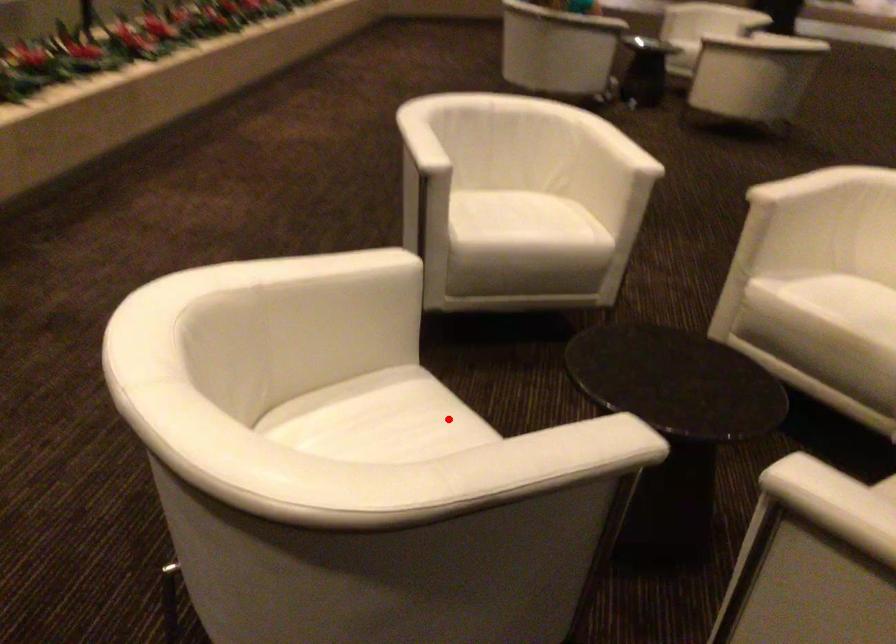
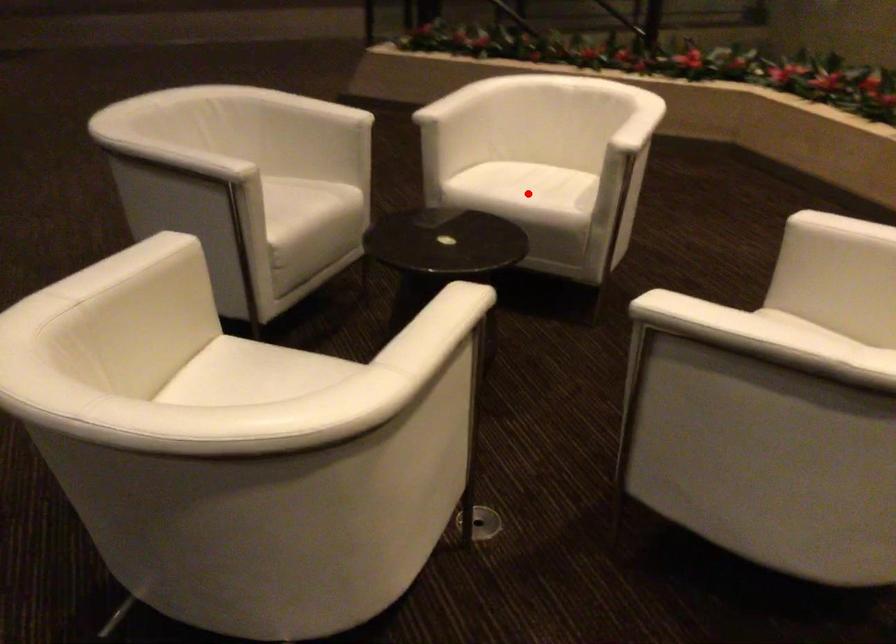
I am providing you with two images of the same scene from different viewpoints. A red point is marked on the first image and another point is marked on the second image. Is the marked point in image1 the same physical position as the marked point in image2?

Yes